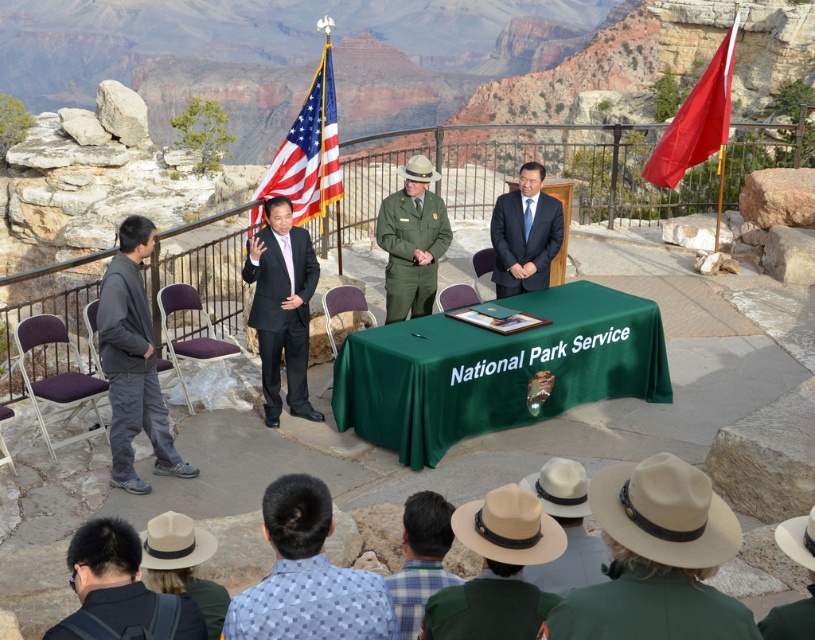
Question: Does light brown felt hat at center have a smaller size compared to green uniform at center?

Choices:
 (A) yes
 (B) no

Answer: (A)

Question: Can you confirm if dark gray fabric pants at left is smaller than red fabric flag at upper right?

Choices:
 (A) no
 (B) yes

Answer: (A)

Question: Does green cloth-covered table at center appear on the left side of dark gray fabric pants at left?

Choices:
 (A) no
 (B) yes

Answer: (A)

Question: Which object is farther from the camera taking this photo?

Choices:
 (A) brown felt hat at center
 (B) dark gray fabric pants at left

Answer: (B)

Question: Which point is farther from the camera taking this photo?

Choices:
 (A) (566, 609)
 (B) (131, 433)

Answer: (B)

Question: Among these objects, which one is farthest from the camera?

Choices:
 (A) beige straw hat at center
 (B) blue dotted shirt at lower center
 (C) green cloth-covered table at center
 (D) dark gray fabric pants at left

Answer: (C)